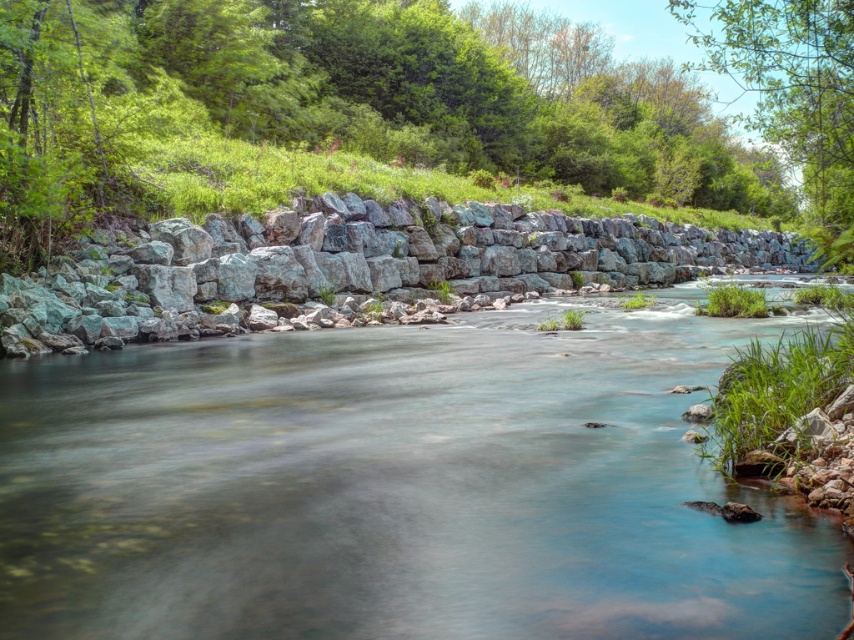
Question: Which of the following is the farthest from the observer?

Choices:
 (A) (342, 218)
 (B) (305, 54)

Answer: (B)

Question: Is gray rock wall at center positioned before green leafy tree at upper right?

Choices:
 (A) yes
 (B) no

Answer: (B)

Question: Based on their relative distances, which object is farther from the gray rock wall at center?

Choices:
 (A) green leafy tree at upper center
 (B) gray stone river at center

Answer: (A)

Question: Does green leafy tree at upper center appear on the left side of gray rock wall at center?

Choices:
 (A) no
 (B) yes

Answer: (A)

Question: Which object is positioned farthest from the green leafy tree at upper right?

Choices:
 (A) green leafy tree at upper center
 (B) gray stone river at center
 (C) gray rock wall at center

Answer: (C)

Question: Is gray stone river at center further to the viewer compared to green leafy tree at upper center?

Choices:
 (A) yes
 (B) no

Answer: (B)